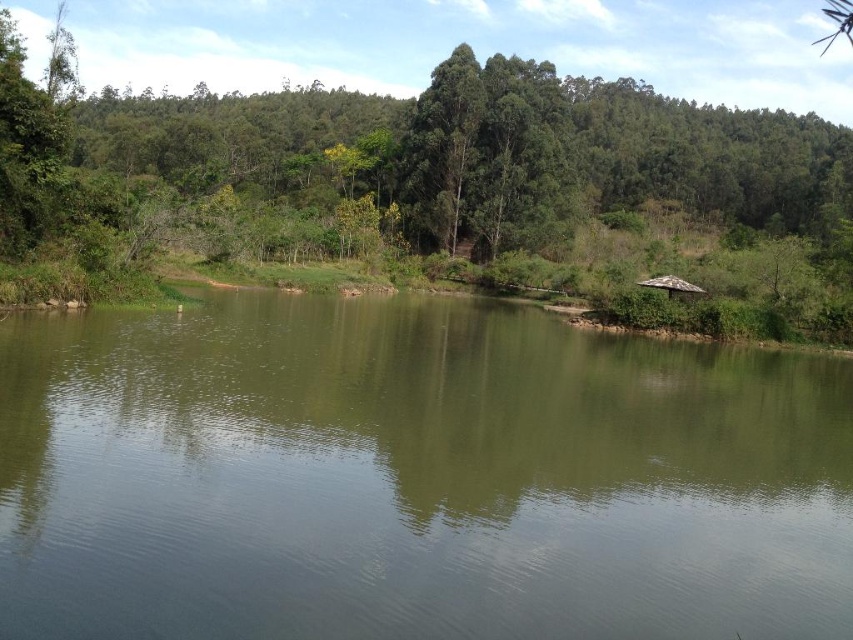
From the picture: You are standing at the edge of the green matte lake at center and want to walk to the green leafy tree at center. Which direction should you head towards?

You should head to the left because the green matte lake at center is to the right of the green leafy tree at center, so moving left will take you towards the tree.